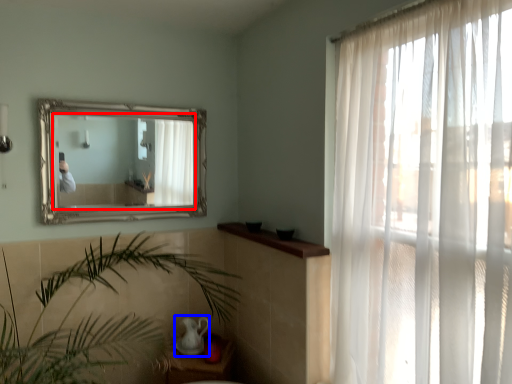
Question: Which object appears farthest to the camera in this image, mirror (highlighted by a red box) or tea pot (highlighted by a blue box)?

Choices:
 (A) mirror
 (B) tea pot

Answer: (B)